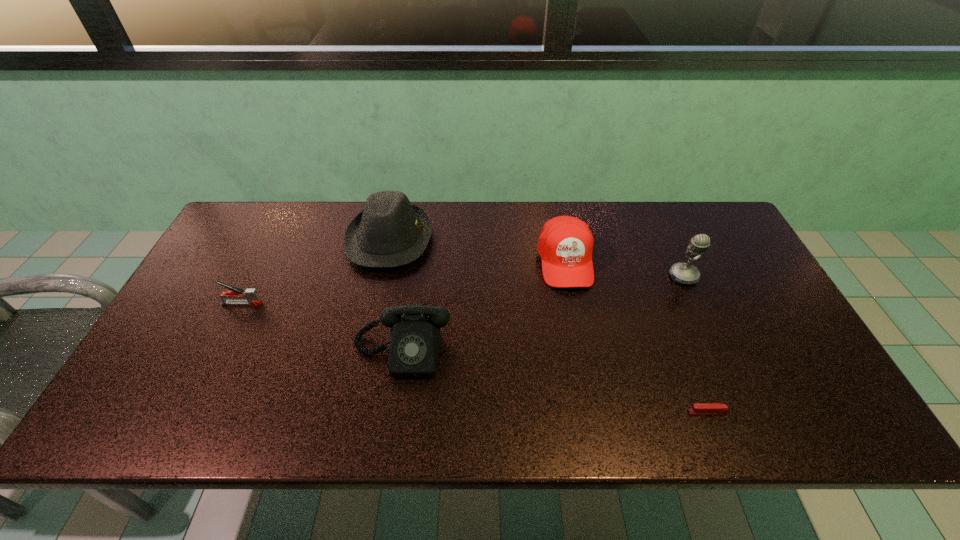
Locate an element on the screen. vacant space located on the front panel of the baseball cap is located at coordinates (596, 425).

I want to click on free location located 0.100m on the dial of the fifth farthest object, so click(x=392, y=419).

Locate an element on the screen. The width and height of the screenshot is (960, 540). free space located 0.300m on the handle side of the leftmost object is located at coordinates (372, 303).

Where is `blank space located on the front-facing side of the nearer stapler`? This screenshot has width=960, height=540. blank space located on the front-facing side of the nearer stapler is located at coordinates (518, 412).

You are a GUI agent. You are given a task and a screenshot of the screen. Output one action in this format:
    pyautogui.click(x=<x>, y=<y>)
    Task: Click on the blank area located 0.050m on the front-facing side of the nearer stapler
    
    Given the screenshot: What is the action you would take?
    pyautogui.click(x=667, y=412)

Find the location of a particular element. free location located on the front-facing side of the nearer stapler is located at coordinates (568, 412).

In order to click on fedora present at the far edge in this screenshot , I will do point(390,231).

You are a GUI agent. You are given a task and a screenshot of the screen. Output one action in this format:
    pyautogui.click(x=<x>, y=<y>)
    Task: Click on the baseball cap that is at the far edge
    The height and width of the screenshot is (540, 960).
    Given the screenshot: What is the action you would take?
    pyautogui.click(x=565, y=244)

Locate an element on the screen. The height and width of the screenshot is (540, 960). object that is positioned at the near edge is located at coordinates point(705,408).

The width and height of the screenshot is (960, 540). In order to click on object that is at the left edge in this screenshot , I will do `click(251, 295)`.